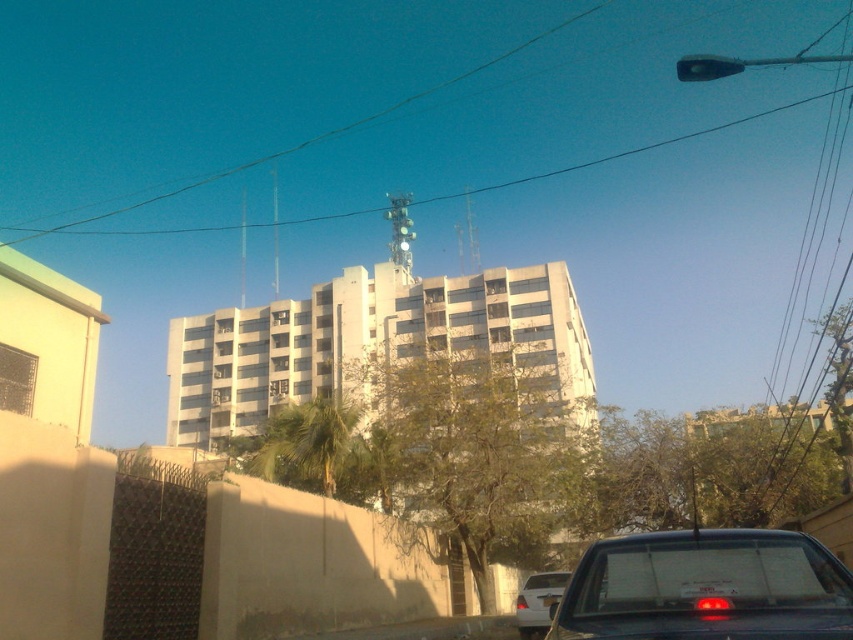
You are standing at the center of the image. The white matte car at lower right is located at coordinates point 0.941, 0.632. If you want to walk towards the car, which direction should you face?

You should face towards the lower right direction to walk towards the white matte car at lower right since it is located at point [538,602].

You are a pedestrian standing at the crosswalk and see the white matte car at lower right and the transparent glass traffic light at center. Which object is taller?

The transparent glass traffic light at center is taller than the white matte car at lower right.

You are a delivery person trying to park your white matte car at lower right. There is a height restriction sign stating that vehicles taller than 1.5 meters are not allowed. The white plastic license plate at center is 0.2 meters tall. Can your car pass the height restriction?

The white matte car at lower right is taller than the white plastic license plate at center, which is 0.2 meters tall. Since the car is taller than 0.2 meters, but the height restriction is 1.5 meters, the car can pass the height restriction unless it exceeds 1.5 meters. However, without knowing the exact height of the car, we cannot confirm. But based on the given information, the car is only compared to the license plate, so it might still be under 1.5 meters.